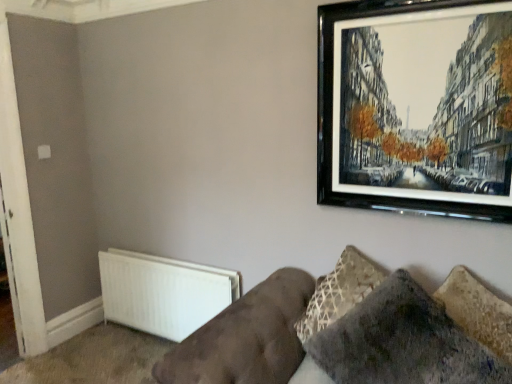
Question: Can you confirm if velvet gray pillow at lower right is positioned to the left of black glossy picture frame at upper right?

Choices:
 (A) yes
 (B) no

Answer: (A)

Question: Is velvet gray pillow at lower right smaller than black glossy picture frame at upper right?

Choices:
 (A) yes
 (B) no

Answer: (B)

Question: Is velvet gray pillow at lower right further to camera compared to black glossy picture frame at upper right?

Choices:
 (A) yes
 (B) no

Answer: (B)

Question: Is the position of velvet gray pillow at lower right less distant than that of black glossy picture frame at upper right?

Choices:
 (A) no
 (B) yes

Answer: (B)

Question: From a real-world perspective, is velvet gray pillow at lower right located beneath black glossy picture frame at upper right?

Choices:
 (A) yes
 (B) no

Answer: (A)

Question: In the image, is black glossy picture frame at upper right positioned in front of or behind velvet brown couch at lower right?

Choices:
 (A) behind
 (B) front

Answer: (A)

Question: From the image's perspective, is black glossy picture frame at upper right located above or below velvet brown couch at lower right?

Choices:
 (A) below
 (B) above

Answer: (B)

Question: From their relative heights in the image, would you say black glossy picture frame at upper right is taller or shorter than velvet brown couch at lower right?

Choices:
 (A) short
 (B) tall

Answer: (B)

Question: From a real-world perspective, is black glossy picture frame at upper right above or below velvet brown couch at lower right?

Choices:
 (A) below
 (B) above

Answer: (B)

Question: From a real-world perspective, relative to white matte door at left, is velvet gray pillow at lower right vertically above or below?

Choices:
 (A) below
 (B) above

Answer: (A)

Question: Is velvet gray pillow at lower right spatially inside white matte door at left, or outside of it?

Choices:
 (A) inside
 (B) outside

Answer: (B)

Question: Is velvet gray pillow at lower right in front of or behind white matte door at left in the image?

Choices:
 (A) behind
 (B) front

Answer: (B)

Question: Considering the positions of velvet gray pillow at lower right and white matte door at left in the image, is velvet gray pillow at lower right wider or thinner than white matte door at left?

Choices:
 (A) wide
 (B) thin

Answer: (A)

Question: Would you say velvet brown couch at lower right is inside or outside white matte door at left?

Choices:
 (A) inside
 (B) outside

Answer: (B)

Question: Based on their sizes in the image, would you say velvet brown couch at lower right is bigger or smaller than white matte door at left?

Choices:
 (A) big
 (B) small

Answer: (A)